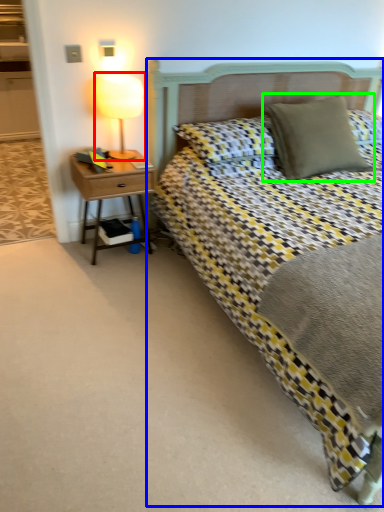
Question: Based on their relative distances, which object is farther from bedside lamp (highlighted by a red box)? Choose from bed (highlighted by a blue box) and pillow (highlighted by a green box).

Choices:
 (A) bed
 (B) pillow

Answer: (B)